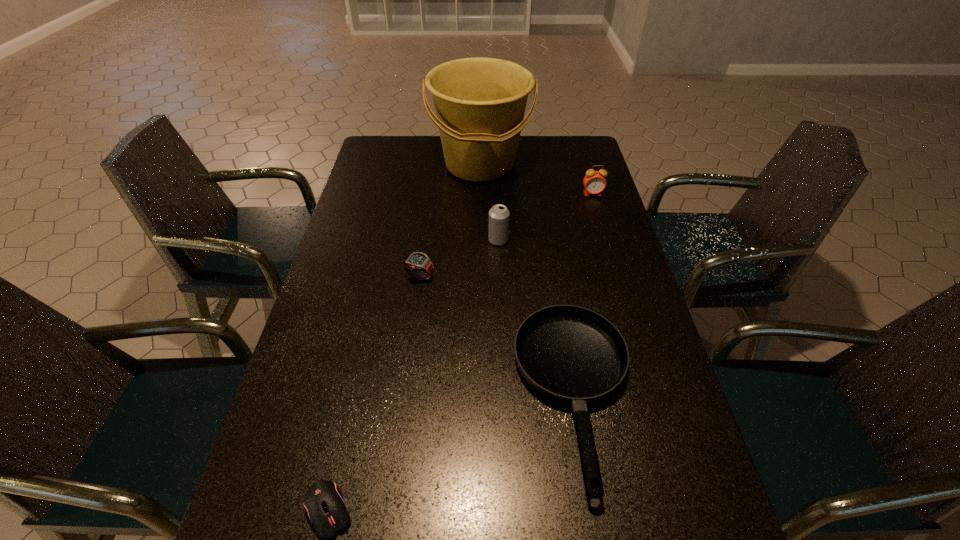
Identify the location of the tallest object. The width and height of the screenshot is (960, 540). (480, 103).

The height and width of the screenshot is (540, 960). I want to click on beer can, so click(499, 215).

What are the coordinates of `the rightmost object` in the screenshot? It's located at (594, 182).

The width and height of the screenshot is (960, 540). Find the location of `the third shortest object`. the third shortest object is located at coordinates (417, 263).

Image resolution: width=960 pixels, height=540 pixels. I want to click on the fourth farthest object, so click(x=417, y=263).

Where is `the second shortest object`? This screenshot has width=960, height=540. the second shortest object is located at coordinates (569, 354).

The width and height of the screenshot is (960, 540). In order to click on blank space located on the side of the bucket with the handle in this screenshot , I will do 480,214.

This screenshot has width=960, height=540. I want to click on vacant space located on the left of the fourth nearest object, so click(372, 240).

Locate an element on the screen. vacant space situated on the face of the rightmost object is located at coordinates (617, 276).

What are the coordinates of `free spot located 0.160m on the left of the third shortest object` in the screenshot? It's located at coord(348,277).